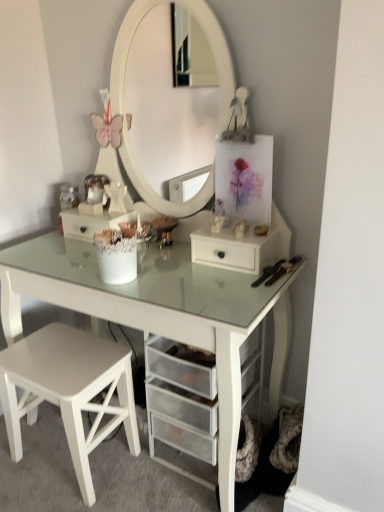
What do you see at coordinates (92, 223) in the screenshot?
I see `white mesh drawer at center` at bounding box center [92, 223].

What do you see at coordinates (243, 247) in the screenshot? The height and width of the screenshot is (512, 384). I see `white matte drawer at center` at bounding box center [243, 247].

Describe the element at coordinates (153, 310) in the screenshot. The height and width of the screenshot is (512, 384). I see `white glass table at center` at that location.

Identify the location of white mesh drawer at center. (92, 223).

Is point (218, 357) farther from viewer compared to point (117, 216)?

No, it is in front of (117, 216).

Is there a large distance between white glass table at center and white mesh drawer at center?

Actually, white glass table at center and white mesh drawer at center are a little close together.

Could you tell me if white glass table at center is turned towards white mesh drawer at center?

Yes, white glass table at center is facing white mesh drawer at center.

What's the angular difference between white glass table at center and white mesh drawer at center's facing directions?

There is a 2.88-degree angle between the facing directions of white glass table at center and white mesh drawer at center.

From the image's perspective, which one is positioned higher, white matte stool at lower left or white glass table at center?

white glass table at center appears higher in the image.

Which object is positioned more to the right, white matte stool at lower left or white glass table at center?

white glass table at center is more to the right.

Who is taller, white matte stool at lower left or white glass table at center?

Standing taller between the two is white glass table at center.

At what (x,y) coordinates should I click in order to perform the action: click on table above the white matte stool at lower left (from the image's perspective). Please return your answer as a coordinate pair (x, y). Image resolution: width=384 pixels, height=512 pixels. Looking at the image, I should click on (153, 310).

Looking at this image, does white glass table at center touch white matte stool at lower left?

No, white glass table at center is not in contact with white matte stool at lower left.

Is white glass table at center thinner than white matte stool at lower left?

Incorrect, the width of white glass table at center is not less than that of white matte stool at lower left.

Based on their sizes in the image, would you say white glass table at center is bigger or smaller than white matte stool at lower left?

Considering their sizes, white glass table at center takes up more space than white matte stool at lower left.

From the image's perspective, which is below, white glass table at center or white matte drawer at center?

white matte drawer at center is shown below in the image.

Are white glass table at center and white matte drawer at center making contact?

No, white glass table at center is not touching white matte drawer at center.

Can we say white glass table at center lies outside white matte drawer at center?

Yes, white glass table at center is outside of white matte drawer at center.

From a real-world perspective, which object stands above the other?

white glass table at center.

Is white matte stool at lower left turned away from white mesh drawer at center?

white matte stool at lower left does not have its back to white mesh drawer at center.

Is white matte stool at lower left directly adjacent to white mesh drawer at center?

No, white matte stool at lower left is not touching white mesh drawer at center.

Considering the relative sizes of white matte stool at lower left and white mesh drawer at center in the image provided, is white matte stool at lower left bigger than white mesh drawer at center?

Indeed, white matte stool at lower left has a larger size compared to white mesh drawer at center.

From a real-world perspective, between white matte stool at lower left and white mesh drawer at center, who is vertically lower?

A: In real-world perspective, white matte stool at lower left is lower.

You are a GUI agent. You are given a task and a screenshot of the screen. Output one action in this format:
    pyautogui.click(x=<x>, y=<y>)
    Task: Click on the drawer that appears behind the white matte stool at lower left
    This screenshot has height=512, width=384.
    Given the screenshot: What is the action you would take?
    click(x=92, y=223)

Is white mesh drawer at center wider than white matte stool at lower left?

No, white mesh drawer at center is not wider than white matte stool at lower left.

From a real-world perspective, is white mesh drawer at center positioned under white matte stool at lower left based on gravity?

Incorrect, from a real-world perspective, white mesh drawer at center is higher than white matte stool at lower left.

Which of these two, white matte stool at lower left or white matte drawer at center, is smaller?

With smaller size is white matte drawer at center.

How distant is white matte stool at lower left from white matte drawer at center?

A distance of 23.92 inches exists between white matte stool at lower left and white matte drawer at center.

From the picture: Is white matte stool at lower left next to white matte drawer at center and touching it?

There is a gap between white matte stool at lower left and white matte drawer at center.

Find the location of a particular element. This screenshot has height=512, width=384. drawer on the left of white glass table at center is located at coordinates (92, 223).

Locate an element on the screen. The width and height of the screenshot is (384, 512). stool below the white glass table at center (from the image's perspective) is located at coordinates (68, 390).

Estimate the real-world distances between objects in this image. Which object is further from white glass table at center, white mesh drawer at center or white matte stool at lower left?

white mesh drawer at center is further to white glass table at center.

When comparing their distances from white glass table at center, does white mesh drawer at center or white matte drawer at center seem further?

white mesh drawer at center is further to white glass table at center.

Which object lies nearer to the anchor point white glass table at center, white matte drawer at center or white matte stool at lower left?

white matte drawer at center is closer to white glass table at center.

Which object lies further to the anchor point white matte drawer at center, white glass table at center or white mesh drawer at center?

The object further to white matte drawer at center is white mesh drawer at center.

Considering their positions, is white matte drawer at center positioned closer to white mesh drawer at center than white matte stool at lower left?

Based on the image, white matte drawer at center appears to be nearer to white mesh drawer at center.

Considering their positions, is white matte stool at lower left positioned further to white glass table at center than white matte drawer at center?

The object further to white glass table at center is white matte stool at lower left.

Looking at the image, which one is located closer to white mesh drawer at center, white glass table at center or white matte drawer at center?

white glass table at center is positioned closer to the anchor white mesh drawer at center.

From the image, which object appears to be farther from white matte drawer at center, white matte stool at lower left or white glass table at center?

white matte stool at lower left lies further to white matte drawer at center than the other object.

Find the location of a particular element. This screenshot has height=512, width=384. the chest of drawers located between white glass table at center and white mesh drawer at center in the depth direction is located at coordinates (243, 247).

The height and width of the screenshot is (512, 384). What are the coordinates of `chest of drawers between white mesh drawer at center and white matte stool at lower left from top to bottom` in the screenshot? It's located at (243, 247).

At what (x,y) coordinates should I click in order to perform the action: click on stool positioned between white glass table at center and white mesh drawer at center from near to far. Please return your answer as a coordinate pair (x, y). Looking at the image, I should click on (68, 390).

Locate an element on the screen. the chest of drawers between white glass table at center and white matte stool at lower left vertically is located at coordinates (243, 247).